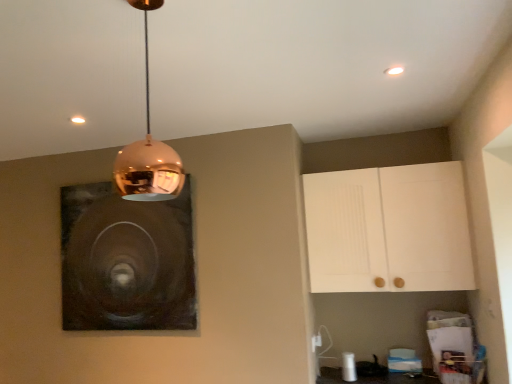
This screenshot has height=384, width=512. What do you see at coordinates (148, 149) in the screenshot? I see `copper reflective pendant light at upper center` at bounding box center [148, 149].

Find the location of a particular element. copper reflective pendant light at upper center is located at coordinates (148, 149).

Considering the relative sizes of copper reflective pendant light at upper center and white matte cabinet at upper right in the image provided, is copper reflective pendant light at upper center taller than white matte cabinet at upper right?

No, copper reflective pendant light at upper center is not taller than white matte cabinet at upper right.

Is copper reflective pendant light at upper center looking in the opposite direction of white matte cabinet at upper right?

No.

From a real-world perspective, is copper reflective pendant light at upper center above or below white matte cabinet at upper right?

In terms of real-world spatial position, copper reflective pendant light at upper center is above white matte cabinet at upper right.

Can you confirm if copper reflective pendant light at upper center is wider than white matte cabinet at upper right?

Incorrect, the width of copper reflective pendant light at upper center does not surpass that of white matte cabinet at upper right.

Is white matte cabinet at upper right not inside dark matte painting at upper left?

white matte cabinet at upper right lies outside dark matte painting at upper left's area.

From a real-world perspective, is white matte cabinet at upper right located higher than dark matte painting at upper left?

Indeed, from a real-world perspective, white matte cabinet at upper right stands above dark matte painting at upper left.

Does white matte cabinet at upper right have a lesser height compared to dark matte painting at upper left?

Indeed, white matte cabinet at upper right has a lesser height compared to dark matte painting at upper left.

Are white matte cabinet at upper right and dark matte painting at upper left located far from each other?

Absolutely, white matte cabinet at upper right is distant from dark matte painting at upper left.

In the image, is white matte cabinet at upper right positioned in front of or behind copper reflective pendant light at upper center?

Visually, white matte cabinet at upper right is located behind copper reflective pendant light at upper center.

Is white matte cabinet at upper right not close to copper reflective pendant light at upper center?

Yes, white matte cabinet at upper right and copper reflective pendant light at upper center are located far from each other.

Considering the relative sizes of white matte cabinet at upper right and copper reflective pendant light at upper center in the image provided, is white matte cabinet at upper right shorter than copper reflective pendant light at upper center?

Incorrect, the height of white matte cabinet at upper right does not fall short of that of copper reflective pendant light at upper center.

Is copper reflective pendant light at upper center a part of white matte cabinet at upper right?

No, white matte cabinet at upper right does not contain copper reflective pendant light at upper center.

Does dark matte painting at upper left have a larger size compared to white matte cabinet at upper right?

No, dark matte painting at upper left is not bigger than white matte cabinet at upper right.

Does dark matte painting at upper left have a lesser height compared to white matte cabinet at upper right?

In fact, dark matte painting at upper left may be taller than white matte cabinet at upper right.

Does dark matte painting at upper left lie in front of white matte cabinet at upper right?

No, dark matte painting at upper left is further to the viewer.

Is dark matte painting at upper left thinner than white matte cabinet at upper right?

Yes.

Considering the positions of objects copper reflective pendant light at upper center and dark matte painting at upper left in the image provided, who is behind, copper reflective pendant light at upper center or dark matte painting at upper left?

dark matte painting at upper left is more distant.

Does copper reflective pendant light at upper center turn towards dark matte painting at upper left?

No, copper reflective pendant light at upper center is not aimed at dark matte painting at upper left.

From the image's perspective, is copper reflective pendant light at upper center on top of dark matte painting at upper left?

Yes, from the image's perspective, copper reflective pendant light at upper center is on top of dark matte painting at upper left.

In terms of size, does copper reflective pendant light at upper center appear bigger or smaller than dark matte painting at upper left?

copper reflective pendant light at upper center is smaller than dark matte painting at upper left.

Locate an element on the screen. The width and height of the screenshot is (512, 384). picture frame that appears behind the copper reflective pendant light at upper center is located at coordinates [126, 261].

From a real-world perspective, relative to copper reflective pendant light at upper center, is dark matte painting at upper left vertically above or below?

Clearly, from a real-world perspective, dark matte painting at upper left is below copper reflective pendant light at upper center.

Is dark matte painting at upper left looking in the opposite direction of copper reflective pendant light at upper center?

dark matte painting at upper left is not turned away from copper reflective pendant light at upper center.

In the image, there is a white matte cabinet at upper right. Find the location of `lamp above it (from the image's perspective)`. lamp above it (from the image's perspective) is located at coordinates (148, 149).

I want to click on picture frame behind the white matte cabinet at upper right, so click(126, 261).

In the scene shown: Considering their positions, is dark matte painting at upper left positioned closer to white matte cabinet at upper right than copper reflective pendant light at upper center?

dark matte painting at upper left.

Which object lies further to the anchor point white matte cabinet at upper right, copper reflective pendant light at upper center or dark matte painting at upper left?

copper reflective pendant light at upper center is further to white matte cabinet at upper right.

Considering their positions, is copper reflective pendant light at upper center positioned closer to dark matte painting at upper left than white matte cabinet at upper right?

white matte cabinet at upper right is positioned closer to the anchor dark matte painting at upper left.

When comparing their distances from copper reflective pendant light at upper center, does white matte cabinet at upper right or dark matte painting at upper left seem further?

white matte cabinet at upper right lies further to copper reflective pendant light at upper center than the other object.

From the image, which object appears to be nearer to copper reflective pendant light at upper center, dark matte painting at upper left or white matte cabinet at upper right?

Among the two, dark matte painting at upper left is located nearer to copper reflective pendant light at upper center.

Estimate the real-world distances between objects in this image. Which object is further from dark matte painting at upper left, white matte cabinet at upper right or copper reflective pendant light at upper center?

Based on the image, copper reflective pendant light at upper center appears to be further to dark matte painting at upper left.

Where is `cabinetry between copper reflective pendant light at upper center and dark matte painting at upper left in the front-back direction`? cabinetry between copper reflective pendant light at upper center and dark matte painting at upper left in the front-back direction is located at coordinates [388, 229].